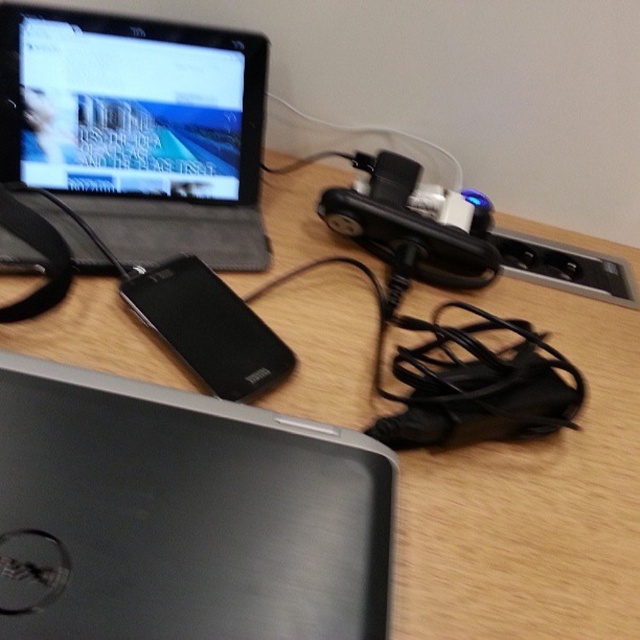
You are organizing cables on a desk. You need to plug in a new device into the power strip. The power strip is behind the black matte speaker at center. Can you easily access the power strip without moving the matte black laptop at upper left?

The matte black laptop at upper left is further to the viewer than the black matte speaker at center, so the laptop is closer to you. Since the power strip is behind the speaker, you would need to move the laptop to access it, making it difficult without moving the laptop.

You are trying to determine the best path for a cable to connect two points on the desk without blocking the Dell laptop. The two points are labeled as point (128, 209) and point (140, 273). Which point is closer to you, making it easier to route the cable around the laptop?

Point (128, 209) is closer to the viewer than point (140, 273), so it would be easier to route the cable around the Dell laptop by starting from this point.

You are organizing your desk and want to stack the matte black laptop at upper left and the black matte speaker at center vertically. Can you place the taller one on top to avoid tipping over?

The matte black laptop at upper left is taller than the black matte speaker at center, so placing the taller one on top would be more stable to prevent tipping over.